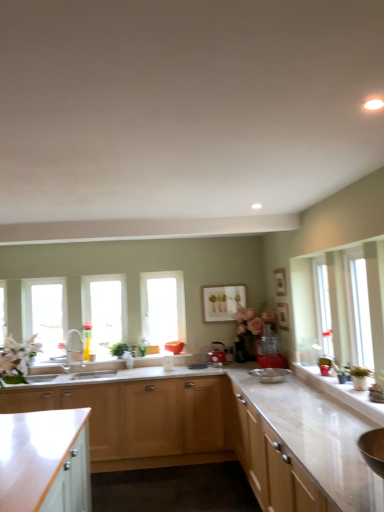
Question: Which direction should I rotate to face transparent glass window at center, the first window positioned from the right, — up or down?

Choices:
 (A) down
 (B) up

Answer: (A)

Question: Considering the relative sizes of red plastic blender at center, positioned as the first appliance in right-to-left order, and metallic red kettle at center, which is the 2th appliance from right to left, in the image provided, is red plastic blender at center, positioned as the first appliance in right-to-left order, bigger than metallic red kettle at center, which is the 2th appliance from right to left,?

Choices:
 (A) no
 (B) yes

Answer: (B)

Question: From the image's perspective, would you say red plastic blender at center, positioned as the first appliance in right-to-left order, is shown under metallic red kettle at center, which is the first appliance in left-to-right order?

Choices:
 (A) no
 (B) yes

Answer: (A)

Question: Is red plastic blender at center, positioned as the first appliance in right-to-left order, directly adjacent to metallic red kettle at center, which is the first appliance in left-to-right order?

Choices:
 (A) no
 (B) yes

Answer: (A)

Question: From a real-world perspective, is red plastic blender at center, acting as the 2th appliance starting from the left, on metallic red kettle at center, which is the first appliance in left-to-right order?

Choices:
 (A) no
 (B) yes

Answer: (B)

Question: Considering the relative sizes of red plastic blender at center, the first appliance viewed from the front, and metallic red kettle at center, the 2th appliance positioned from the front, in the image provided, is red plastic blender at center, the first appliance viewed from the front, thinner than metallic red kettle at center, the 2th appliance positioned from the front,?

Choices:
 (A) yes
 (B) no

Answer: (B)

Question: Is red plastic blender at center, the first appliance viewed from the front, taller than metallic red kettle at center, the 2th appliance positioned from the front?

Choices:
 (A) no
 (B) yes

Answer: (B)

Question: Is matte white picture frame at center surrounded by light wood cabinet at lower center, acting as the second cabinetry starting from the left?

Choices:
 (A) no
 (B) yes

Answer: (A)

Question: From the image's perspective, is light wood cabinet at lower center, which is the 2th cabinetry in right-to-left order, located beneath matte white picture frame at center?

Choices:
 (A) yes
 (B) no

Answer: (A)

Question: From the image's perspective, is light wood cabinet at lower center, which is the 2th cabinetry in right-to-left order, on matte white picture frame at center?

Choices:
 (A) yes
 (B) no

Answer: (B)

Question: Can you confirm if light wood cabinet at lower center, which is the 2th cabinetry in right-to-left order, is shorter than matte white picture frame at center?

Choices:
 (A) yes
 (B) no

Answer: (B)

Question: Is the position of light wood cabinet at lower center, which is the 2th cabinetry in right-to-left order, less distant than that of matte white picture frame at center?

Choices:
 (A) no
 (B) yes

Answer: (B)

Question: Considering the relative sizes of light wood cabinet at lower center, acting as the second cabinetry starting from the left, and matte white picture frame at center in the image provided, is light wood cabinet at lower center, acting as the second cabinetry starting from the left, smaller than matte white picture frame at center?

Choices:
 (A) no
 (B) yes

Answer: (A)

Question: Considering the relative sizes of white marble countertop at lower center and metallic red kettle at center, which is the 2th appliance from right to left, in the image provided, is white marble countertop at lower center shorter than metallic red kettle at center, which is the 2th appliance from right to left,?

Choices:
 (A) no
 (B) yes

Answer: (A)